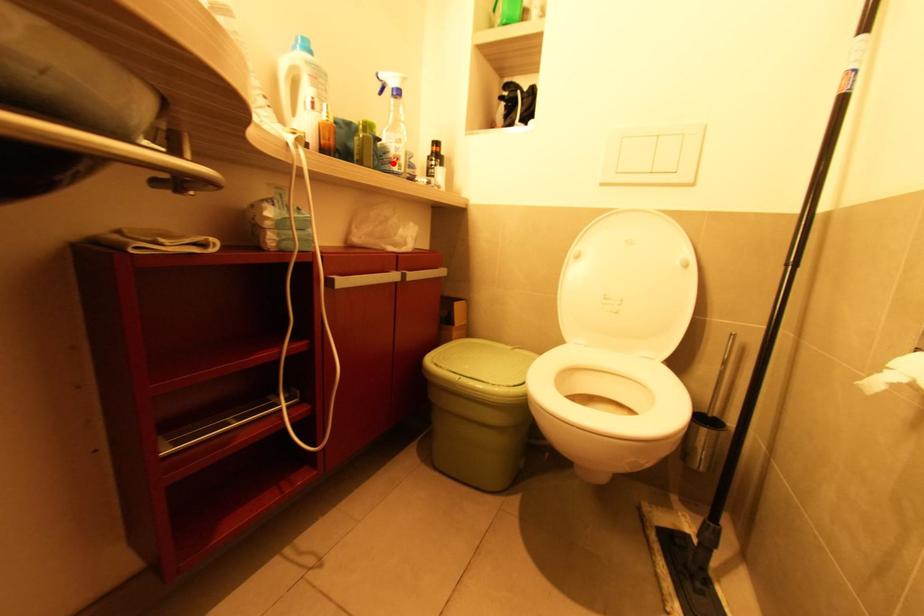
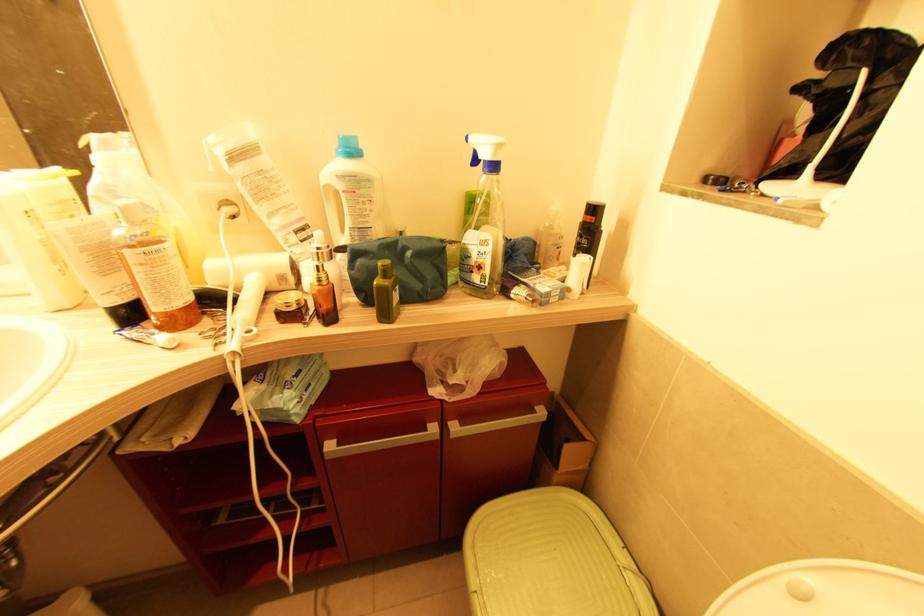
The point at the highlighted location is marked in the first image. Where is the corresponding point in the second image?

(473, 273)